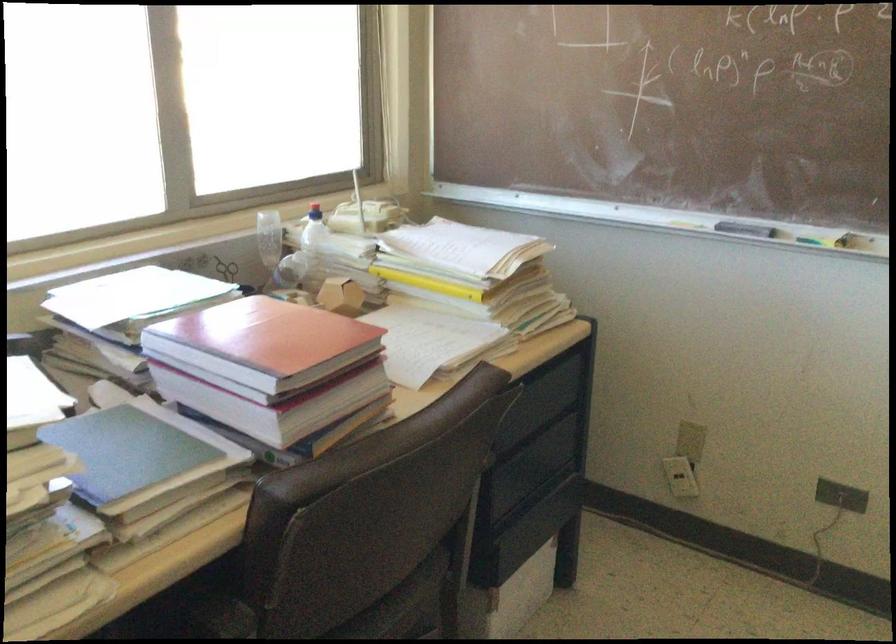
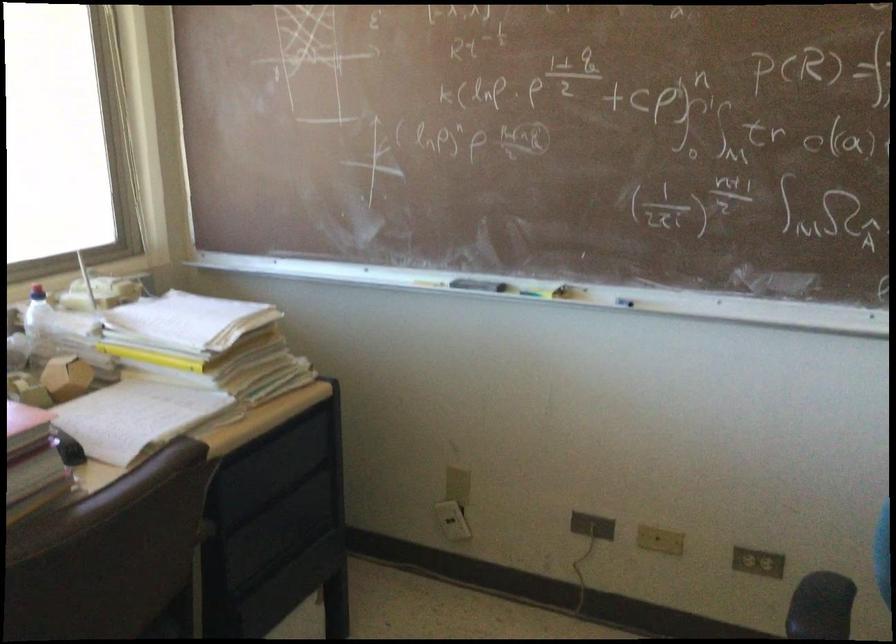
Question: What movement of the cameraman would produce the second image?

Choices:
 (A) Left
 (B) Right
 (C) Forward
 (D) Backward

Answer: (B)